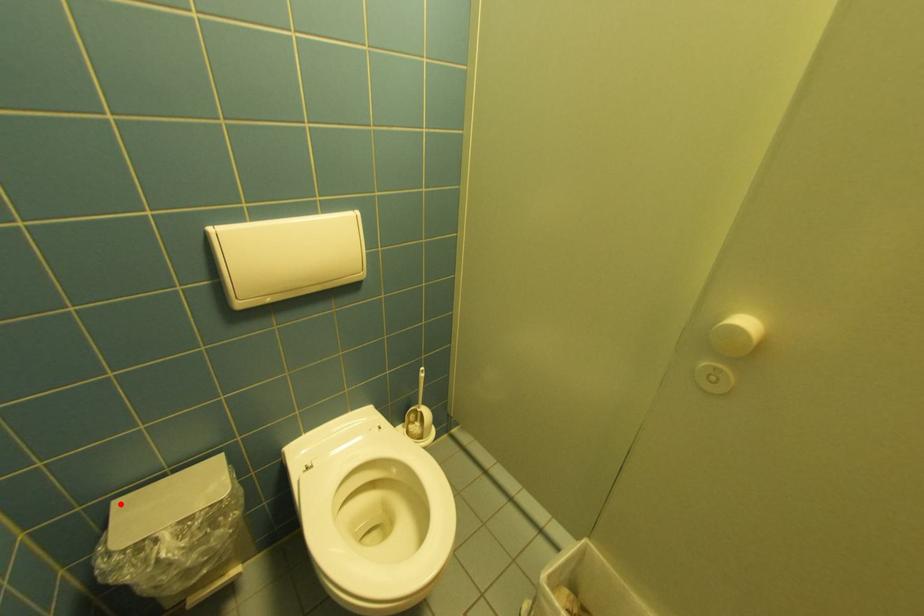
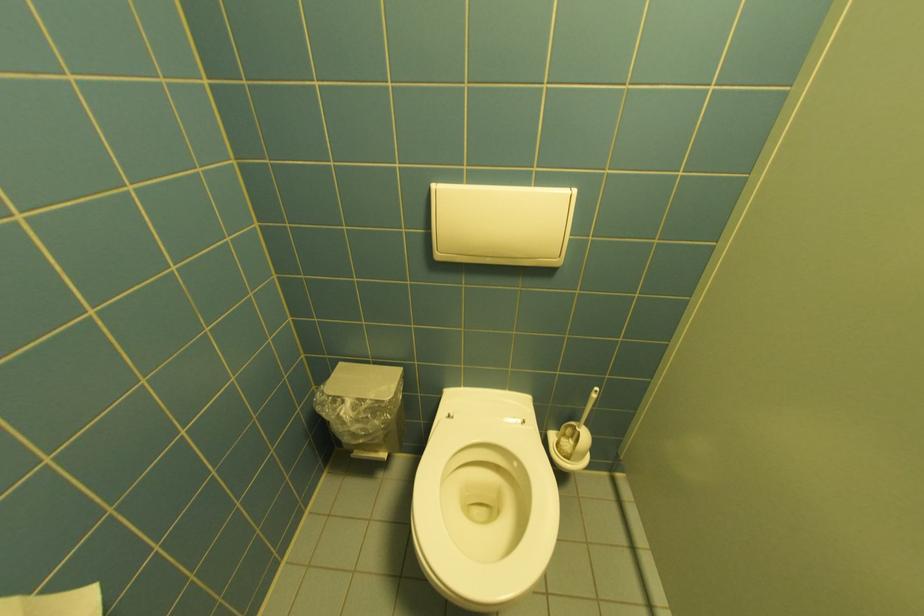
In the second image, find the point that corresponds to the highlighted location in the first image.

(347, 365)